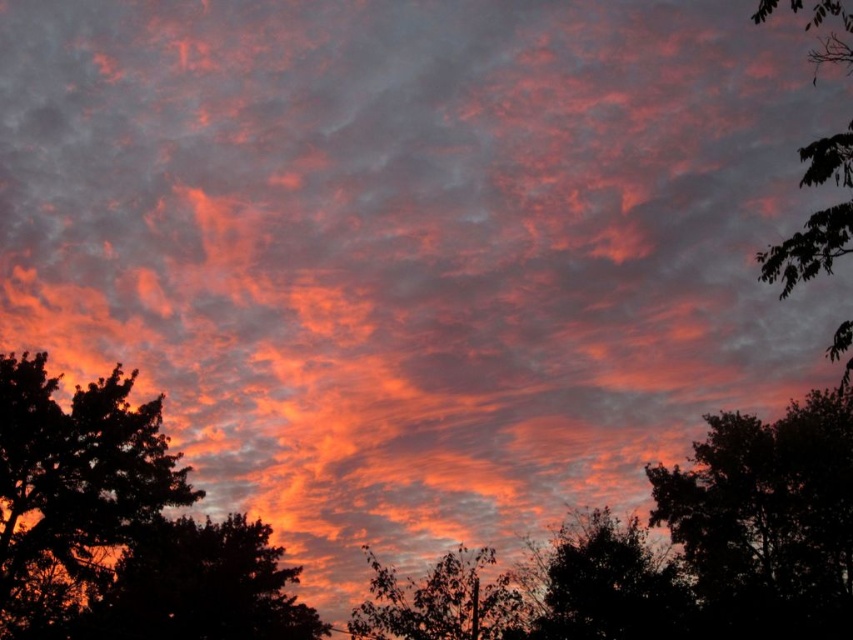
Image resolution: width=853 pixels, height=640 pixels. In order to click on dark green leafy tree at lower right in this screenshot , I will do `click(611, 586)`.

Where is `dark green leafy tree at lower right`? dark green leafy tree at lower right is located at coordinates (611, 586).

From the picture: Does silhouette leafy tree at right come in front of dark green leafy tree at lower right?

Yes, it is.

Who is more forward, (791, 634) or (625, 566)?

Point (625, 566) is more forward.

Measure the distance between point (683, 556) and camera.

Point (683, 556) is 178.22 feet from camera.

Find the location of `silhouette leafy tree at right`. silhouette leafy tree at right is located at coordinates (767, 518).

Is point (142, 621) positioned before point (554, 612)?

No, (142, 621) is behind (554, 612).

Can you confirm if dark green leafy tree at lower left is positioned to the right of dark green leafy tree at lower right?

In fact, dark green leafy tree at lower left is to the left of dark green leafy tree at lower right.

Locate an element on the screen. dark green leafy tree at lower left is located at coordinates (201, 588).